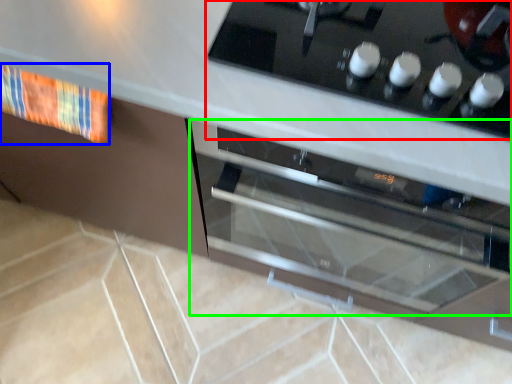
Question: Based on their relative distances, which object is farther from home appliance (highlighted by a red box)? Choose from material (highlighted by a blue box) and oven (highlighted by a green box).

Choices:
 (A) material
 (B) oven

Answer: (A)